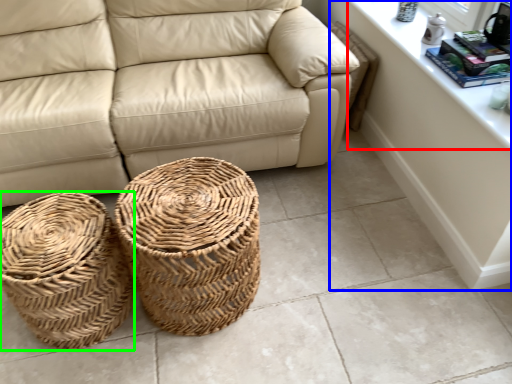
Question: Estimate the real-world distances between objects in this image. Which object is closer to window sill (highlighted by a red box), dresser (highlighted by a blue box) or basket (highlighted by a green box)?

Choices:
 (A) dresser
 (B) basket

Answer: (A)